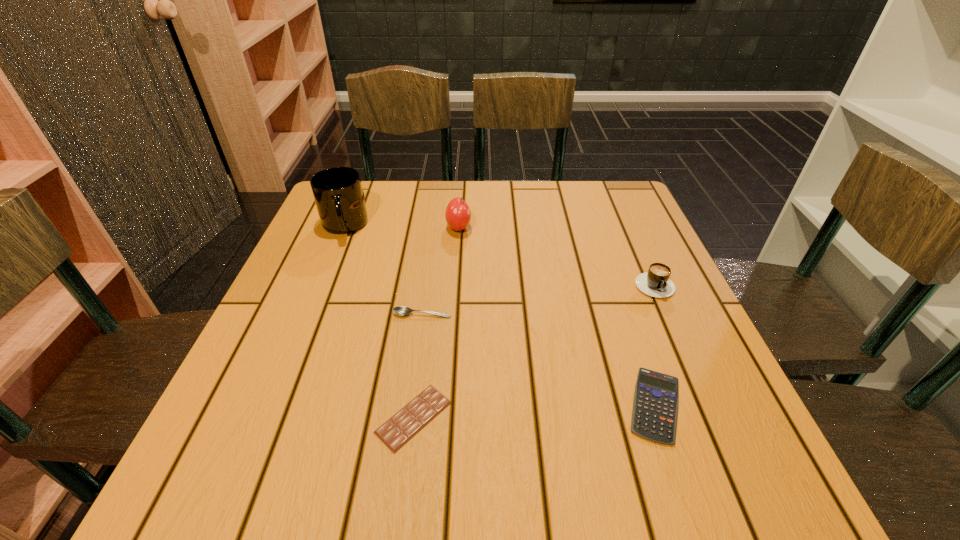
Locate an element on the screen. cappuccino that is at the right edge is located at coordinates (656, 283).

Where is `calculator at the right edge`? The height and width of the screenshot is (540, 960). calculator at the right edge is located at coordinates (655, 406).

Where is `object situated at the far left corner`? The height and width of the screenshot is (540, 960). object situated at the far left corner is located at coordinates (338, 194).

This screenshot has width=960, height=540. Find the location of `object at the near right corner`. object at the near right corner is located at coordinates (655, 406).

Where is `blank area at the far edge`? Image resolution: width=960 pixels, height=540 pixels. blank area at the far edge is located at coordinates (531, 208).

Locate an element on the screen. vacant space at the near edge is located at coordinates (492, 465).

In the image, there is a desktop. Where is `free space at the left edge`? This screenshot has width=960, height=540. free space at the left edge is located at coordinates (269, 410).

At what (x,y) coordinates should I click in order to perform the action: click on vacant area at the right edge of the desktop. Please return your answer as a coordinate pair (x, y). This screenshot has width=960, height=540. Looking at the image, I should click on (702, 427).

The width and height of the screenshot is (960, 540). In order to click on vacant space at the near left corner of the desktop in this screenshot , I will do `click(204, 470)`.

I want to click on vacant space at the far right corner of the desktop, so click(x=602, y=194).